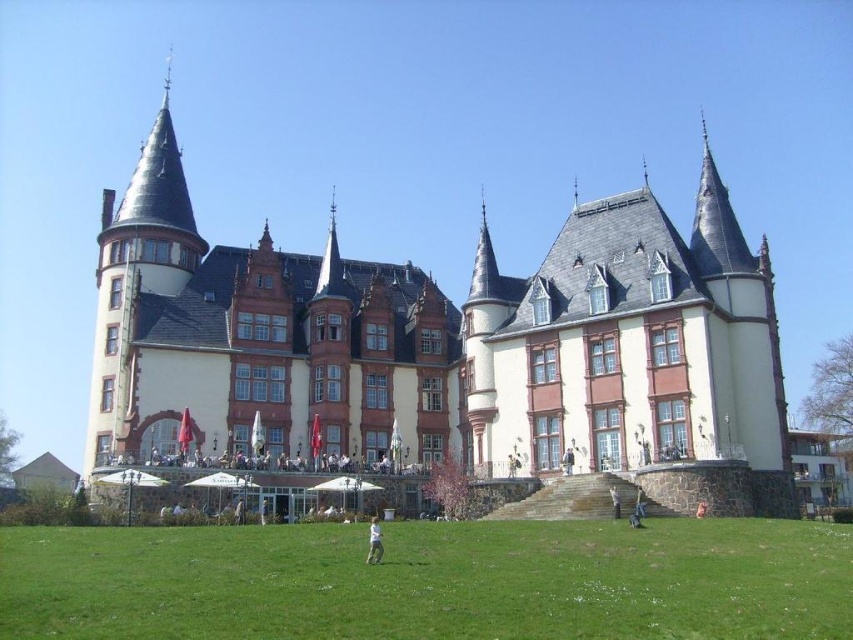
You are standing in front of the grand building and want to walk towards the two points marked on the ground floor. Which point, point (x=573, y=381) or point (x=564, y=464), will you reach first?

You will reach point (x=573, y=381) first because it is closer to you than point (x=564, y=464), which is further away.